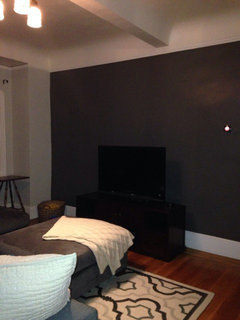
Image resolution: width=240 pixels, height=320 pixels. I want to click on section of sofa or bed, so click(35, 244), click(76, 246), click(11, 246).